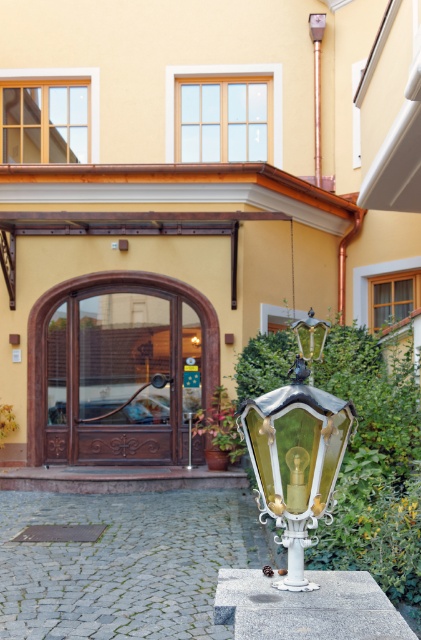
Question: Which object is farther from the camera taking this photo?

Choices:
 (A) metallic copper pole at upper center
 (B) green glass lamp post at center

Answer: (A)

Question: Which object is closer to the camera taking this photo?

Choices:
 (A) green glass lamp post at center
 (B) metallic copper pole at upper center

Answer: (A)

Question: Can you confirm if green glass lamp post at center is positioned to the right of metallic copper pole at upper center?

Choices:
 (A) yes
 (B) no

Answer: (B)

Question: Does green glass lamp post at center appear over metallic copper pole at upper center?

Choices:
 (A) no
 (B) yes

Answer: (A)

Question: Which point appears closest to the camera in this image?

Choices:
 (A) (316, 84)
 (B) (328, 444)

Answer: (B)

Question: Can you confirm if green glass lamp post at center is positioned above metallic copper pole at upper center?

Choices:
 (A) yes
 (B) no

Answer: (B)